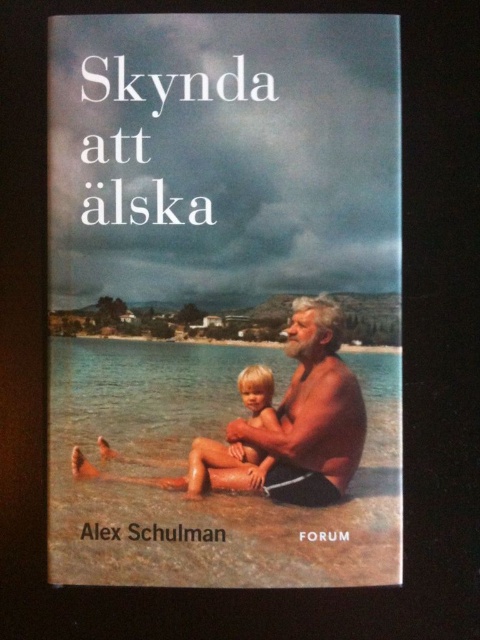
You are designing a bookshelf where the matte black book cover at center needs to be placed next to the smooth skin man at center. Based on the image, which object should be placed to the left to ensure proper alignment?

The matte black book cover at center might be wider than smooth skin man at center, so placing the book cover to the left would ensure proper alignment as it occupies more horizontal space.

You are an art student analyzing the book cover. You notice the matte black book cover at center and the smooth skin man at center. Which object is positioned closer to you?

The matte black book cover at center is closer to the viewer than the smooth skin man at center.

You are an art student analyzing the book cover. You notice the matte black book cover at center and the smooth skin man at center. Which object is positioned more to the left?

The matte black book cover at center is to the left of the smooth skin man at center, so it is positioned more to the left.